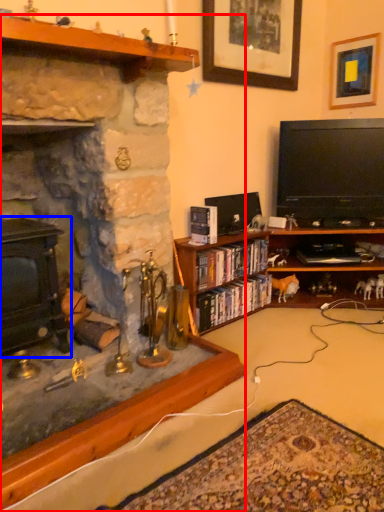
Question: Among these objects, which one is farthest to the camera, fireplace (highlighted by a red box) or fireplace (highlighted by a blue box)?

Choices:
 (A) fireplace
 (B) fireplace

Answer: (B)